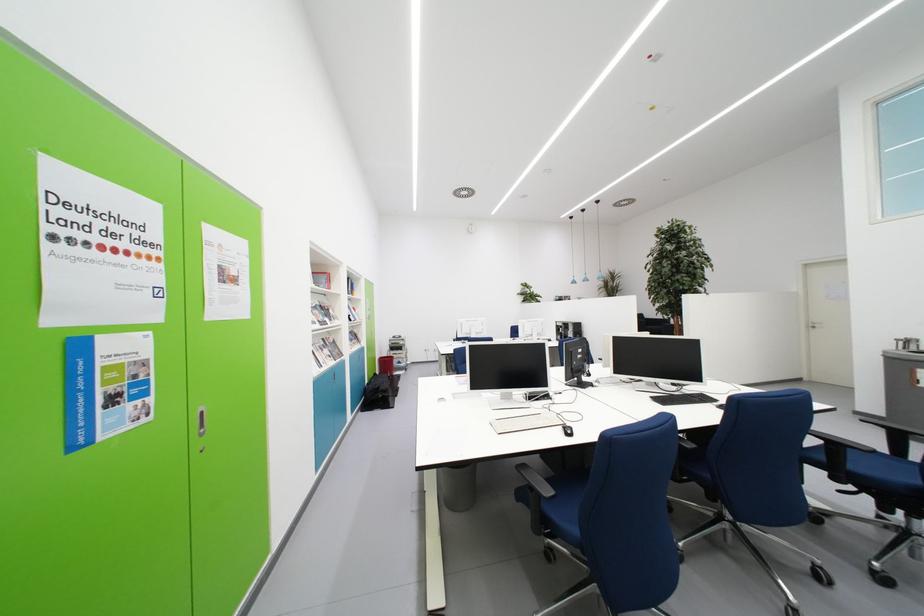
The width and height of the screenshot is (924, 616). I want to click on silver cabinet handle, so click(x=201, y=421).